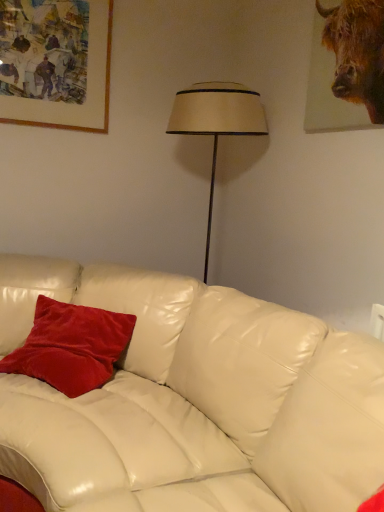
Question: Considering the positions of velvet red pillow at center and brown textured fur at upper right in the image, is velvet red pillow at center taller or shorter than brown textured fur at upper right?

Choices:
 (A) short
 (B) tall

Answer: (A)

Question: Relative to brown textured fur at upper right, is velvet red pillow at center in front or behind?

Choices:
 (A) front
 (B) behind

Answer: (B)

Question: Which of these objects is positioned closest to the wooden picture frame at upper left?

Choices:
 (A) brown textured fur at upper right
 (B) velvet red pillow at center

Answer: (B)

Question: Considering the real-world distances, which object is closest to the wooden picture frame at upper left?

Choices:
 (A) brown textured fur at upper right
 (B) velvet red pillow at center

Answer: (B)